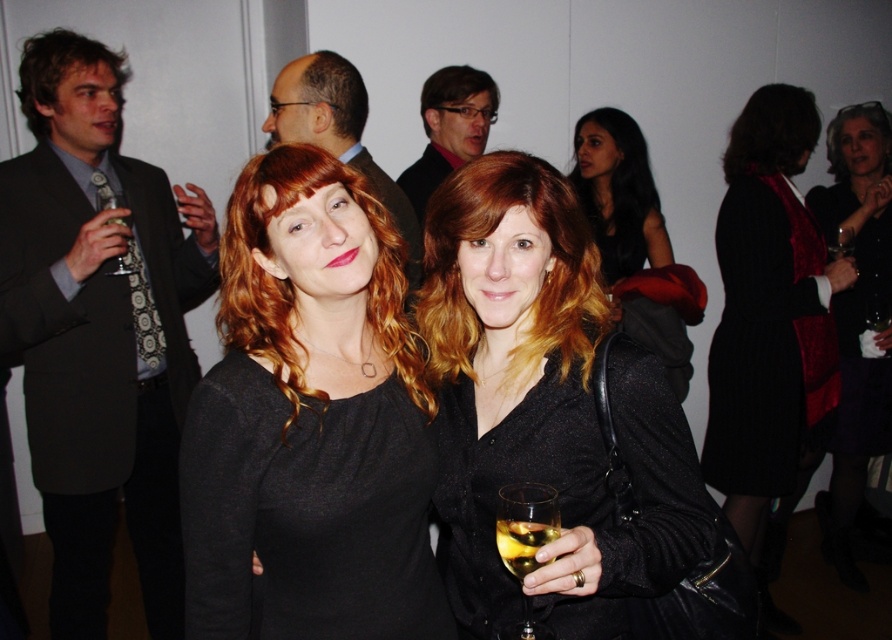
You are a photographer at an art exhibition and need to capture a candid shot of both the black textured dress at center and the velvet black dress at center. Since you want to ensure both dresses are fully visible in the photo, which dress should you focus on to avoid cropping the bottom hem?

The black textured dress at center is shorter than the velvet black dress at center, so focusing on the velvet black dress at center will ensure the bottom hem of both dresses remains visible in the photo.

You are a photographer at an art exhibition and need to decide which dress to feature in your photo. Both the black textured dress at center and the velvet black dress at center are in the frame. Based on their sizes, which dress should you focus on to ensure it stands out more?

The velvet black dress at center is larger than the black textured dress at center, so focusing on the velvet black dress at center would make it stand out more due to its larger size.

You are a photographer at the event and want to take a closeup shot of the black textured dress at center. The camera can focus on objects within 35 inches. Can you take the photo without moving closer?

The black textured dress at center is 37.07 inches away from the camera, which is beyond the camera focus range of 35 inches. Therefore, you cannot take the photo without moving closer.